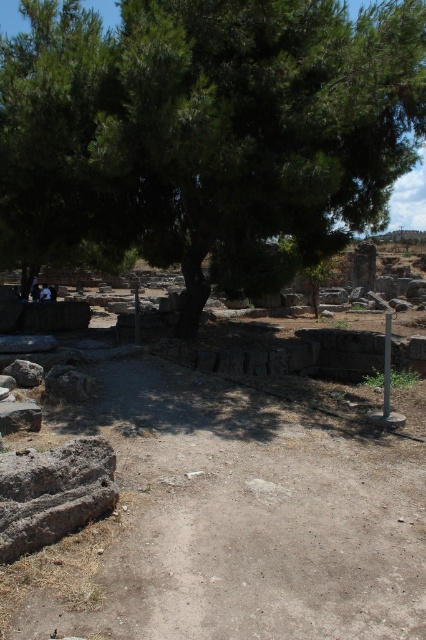
Question: Which of the following is the closest to the observer?

Choices:
 (A) (221, 124)
 (B) (383, 346)

Answer: (A)

Question: Which point is closer to the camera?

Choices:
 (A) (334, 22)
 (B) (388, 324)

Answer: (A)

Question: Does green leafy tree at upper left appear on the left side of smooth stone pillar at center-right?

Choices:
 (A) no
 (B) yes

Answer: (B)

Question: Can you confirm if green leafy tree at upper left is positioned below smooth stone pillar at center-right?

Choices:
 (A) yes
 (B) no

Answer: (B)

Question: Can you confirm if green leafy tree at upper left is thinner than smooth stone pillar at center-right?

Choices:
 (A) yes
 (B) no

Answer: (B)

Question: Which of the following is the closest to the observer?

Choices:
 (A) (383, 417)
 (B) (71, 65)

Answer: (A)